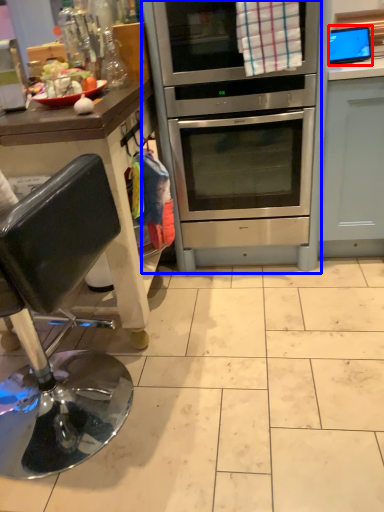
Question: Which object appears closest to the camera in this image, appliance (highlighted by a red box) or oven (highlighted by a blue box)?

Choices:
 (A) appliance
 (B) oven

Answer: (B)